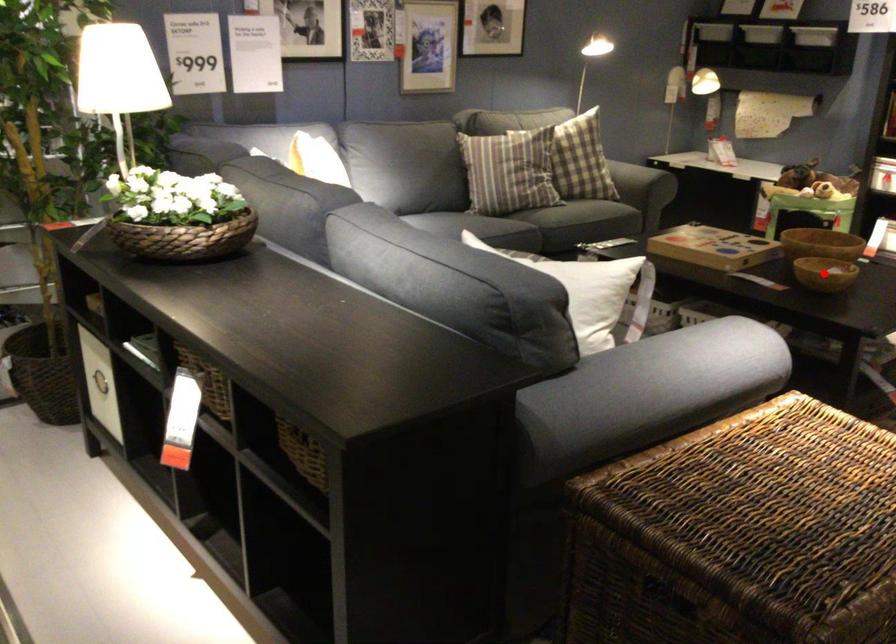
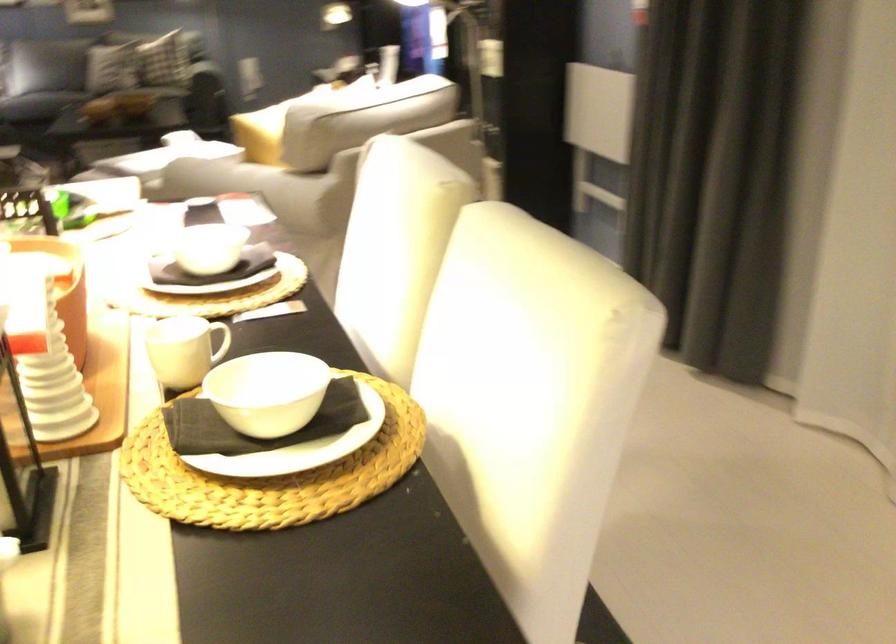
Question: I am providing you with two images of the same scene from different viewpoints. A red point is marked on the first image. Can you still see the location of the red point in image 2?

Choices:
 (A) Yes
 (B) No

Answer: (B)